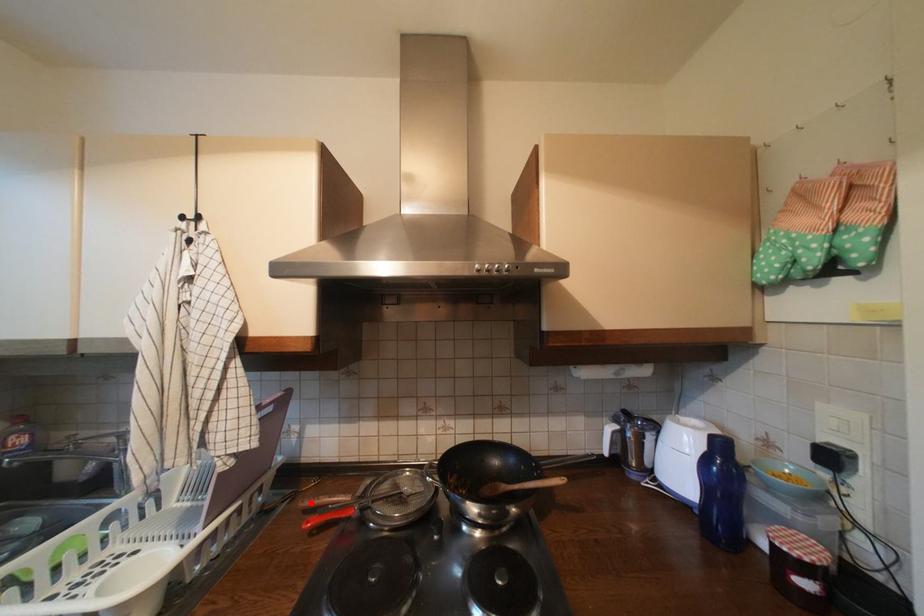
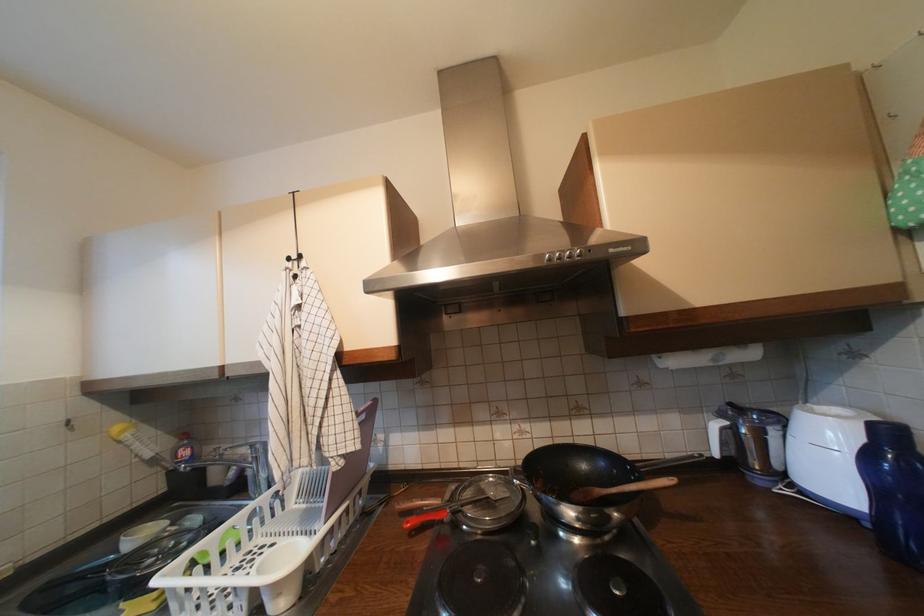
Locate, in the second image, the point that corresponds to the highlighted location in the first image.

(407, 506)